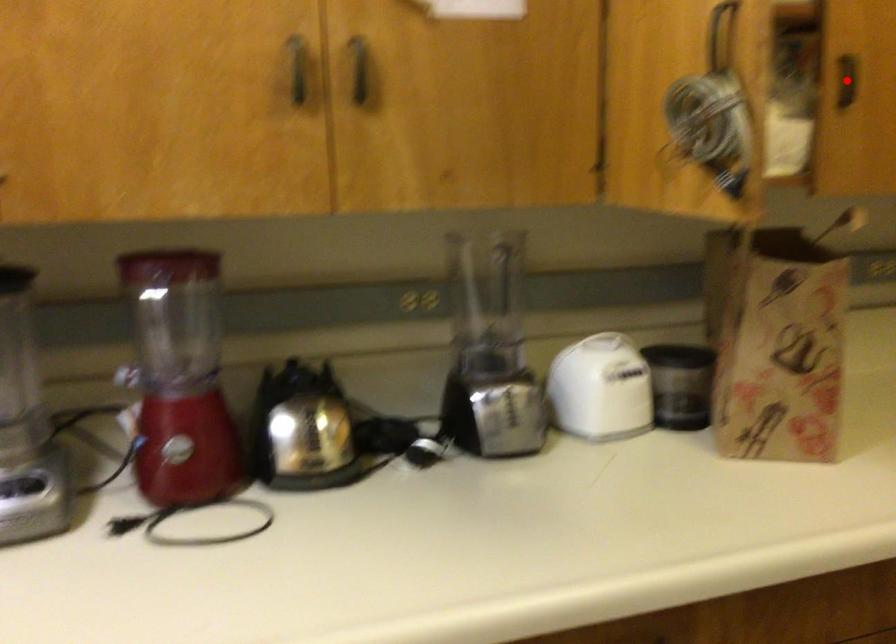
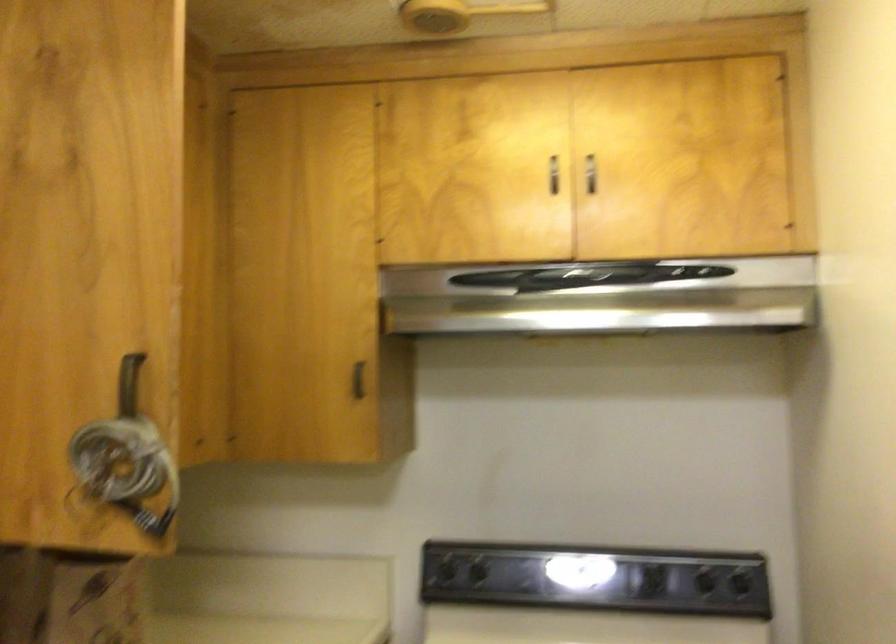
Question: I am providing you with two images of the same scene from different viewpoints. A red point is marked on the first image. Is the red point's position out of view in image 2?

Choices:
 (A) Yes
 (B) No

Answer: (A)